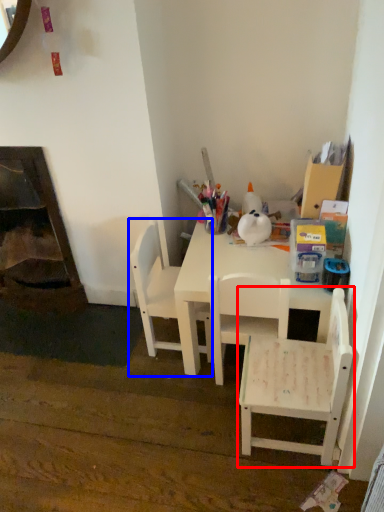
Question: Which of the following is the farthest to the observer, chair (highlighted by a red box) or chair (highlighted by a blue box)?

Choices:
 (A) chair
 (B) chair

Answer: (B)